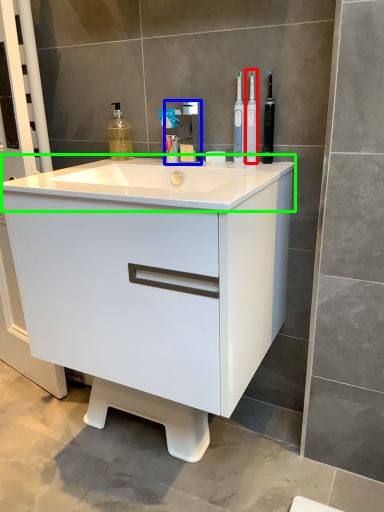
Question: Based on their relative distances, which object is nearer to toothbrush (highlighted by a red box)? Choose from tap (highlighted by a blue box) and counter top (highlighted by a green box).

Choices:
 (A) tap
 (B) counter top

Answer: (A)